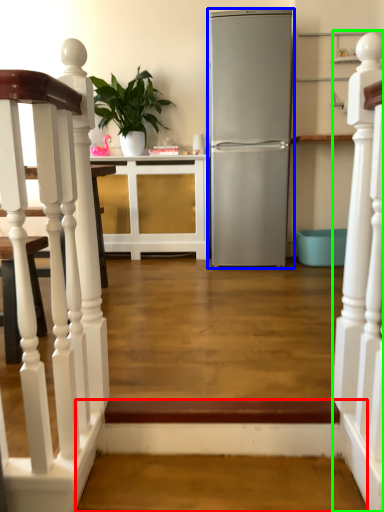
Question: Based on their relative distances, which object is nearer to stairwell (highlighted by a red box)? Choose from refrigerator (highlighted by a blue box) and rail (highlighted by a green box).

Choices:
 (A) refrigerator
 (B) rail

Answer: (B)